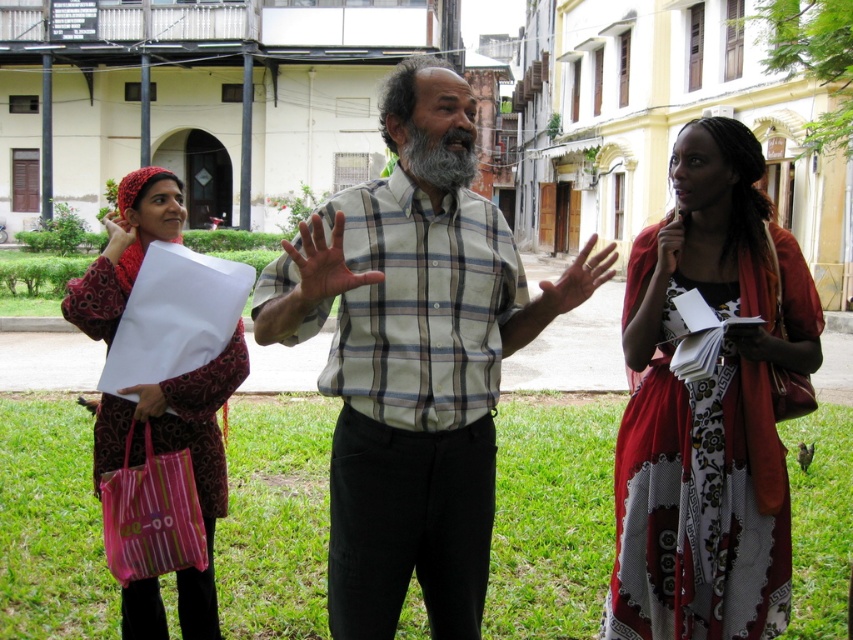
Question: Which object is positioned closest to the matte red scarf at left?

Choices:
 (A) floral cotton dress at center
 (B) pink striped fabric shopping bag at lower left
 (C) light beige plaid shirt at center

Answer: (B)

Question: Does floral cotton dress at center come in front of matte red scarf at left?

Choices:
 (A) no
 (B) yes

Answer: (B)

Question: Which object is the farthest from the floral cotton dress at center?

Choices:
 (A) matte red scarf at left
 (B) light beige plaid shirt at center
 (C) pink striped fabric shopping bag at lower left

Answer: (C)

Question: Does light beige plaid shirt at center appear on the left side of pink striped fabric shopping bag at lower left?

Choices:
 (A) yes
 (B) no

Answer: (B)

Question: Does light beige plaid shirt at center appear under matte red scarf at left?

Choices:
 (A) yes
 (B) no

Answer: (B)

Question: Which is farther from the pink striped fabric shopping bag at lower left?

Choices:
 (A) light beige plaid shirt at center
 (B) floral cotton dress at center
 (C) matte red scarf at left

Answer: (B)